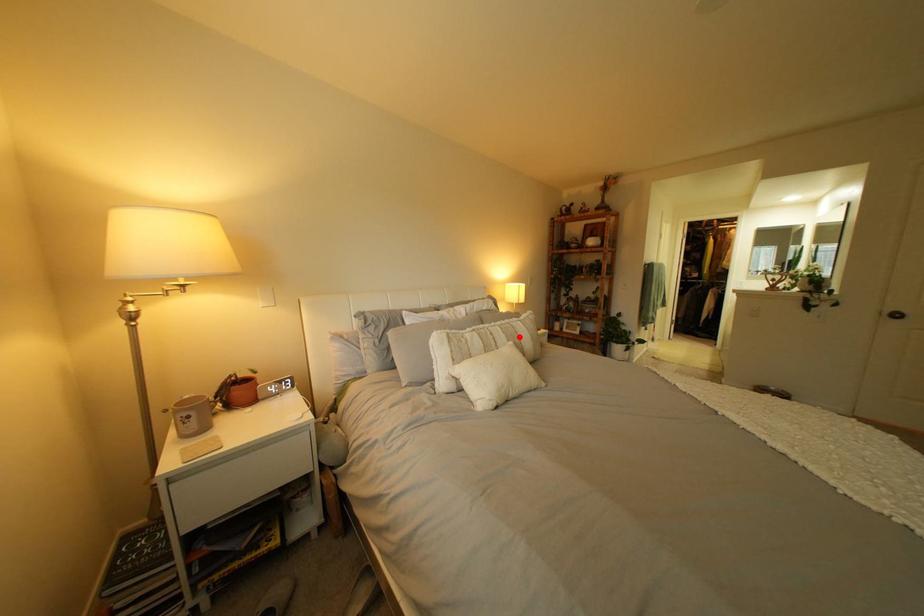
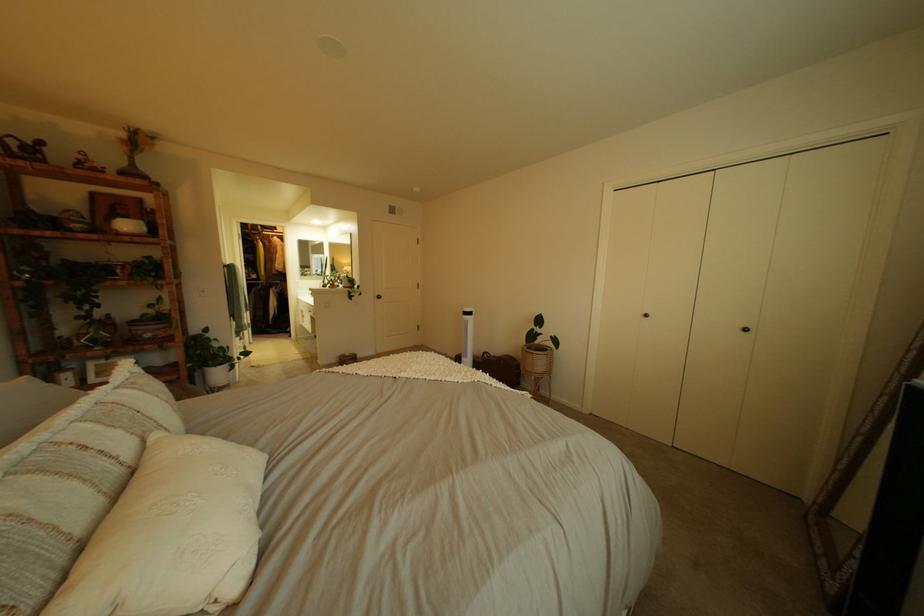
In the second image, find the point that corresponds to the highlighted location in the first image.

(134, 434)